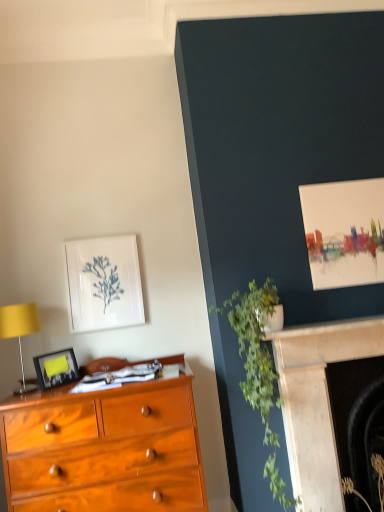
This screenshot has width=384, height=512. Describe the element at coordinates (259, 369) in the screenshot. I see `green leafy plant at upper right, which is counted as the 2th plant, starting from the right` at that location.

In order to face green leafy plant at lower right, which appears as the second plant when viewed from the left, should I rotate leftwards or rightwards?

Turn right approximately 23.437 degrees to face it.

This screenshot has height=512, width=384. I want to click on white matte picture frame at upper left, which is the 2th picture frame in bottom-to-top order, so click(103, 283).

Measure the distance between matte yellow lampshade at left and matte black picture frame at left, which is counted as the first picture frame, starting from the bottom.

They are 17.57 centimeters apart.

Is point (21, 386) positioned in front of point (56, 351)?

Yes.

Which of these two, matte yellow lampshade at left or matte black picture frame at left, the second picture frame viewed from the back, is wider?

Wider between the two is matte yellow lampshade at left.

From the image's perspective, is matte yellow lampshade at left positioned above or below matte black picture frame at left, which is counted as the first picture frame, starting from the bottom?

From the image's perspective, matte yellow lampshade at left appears above matte black picture frame at left, which is counted as the first picture frame, starting from the bottom.

The image size is (384, 512). What are the coordinates of `table lamp below the white matte picture frame at upper left, positioned as the first picture frame in top-to-bottom order (from the image's perspective)` in the screenshot? It's located at (19, 331).

In the image, is matte yellow lampshade at left on the left side or the right side of white matte picture frame at upper left, the first picture frame positioned from the back?

Clearly, matte yellow lampshade at left is on the left of white matte picture frame at upper left, the first picture frame positioned from the back, in the image.

Between matte yellow lampshade at left and white matte picture frame at upper left, positioned as the first picture frame in top-to-bottom order, which one is positioned in front?

matte yellow lampshade at left is more forward.

Can we say matte yellow lampshade at left lies outside white matte picture frame at upper left, positioned as the first picture frame in top-to-bottom order?

matte yellow lampshade at left lies outside white matte picture frame at upper left, positioned as the first picture frame in top-to-bottom order,'s area.

From the green leafy plant at upper right, which is counted as the 2th plant, starting from the right, count 2nd fireplaces backward and point to it. Please provide its 2D coordinates.

[(358, 420)]

Measure the distance between marble fireplace at lower right, the first fireplace in the back-to-front sequence, and green leafy plant at upper right, which is counted as the 2th plant, starting from the right.

marble fireplace at lower right, the first fireplace in the back-to-front sequence, is 43.13 centimeters away from green leafy plant at upper right, which is counted as the 2th plant, starting from the right.

From the image's perspective, between marble fireplace at lower right, which is the 2th fireplace from front to back, and green leafy plant at upper right, which is the 1th plant in left-to-right order, who is located below?

marble fireplace at lower right, which is the 2th fireplace from front to back, is shown below in the image.

Considering the positions of point (335, 386) and point (246, 352), is point (335, 386) closer or farther from the camera than point (246, 352)?

Point (335, 386) is farther from the camera than point (246, 352).

The image size is (384, 512). Identify the location of plant that is above the marble fireplace at lower right, placed as the 1th fireplace when sorted from front to back (from the image's perspective). (259, 369).

Based on the photo, from the image's perspective, between green leafy plant at upper right, which is counted as the 2th plant, starting from the right, and marble fireplace at lower right, placed as the 1th fireplace when sorted from front to back, which one is located above?

green leafy plant at upper right, which is counted as the 2th plant, starting from the right, appears higher in the image.

From a real-world perspective, is green leafy plant at upper right, which is counted as the 2th plant, starting from the right, physically located above or below marble fireplace at lower right, the 2th fireplace in the back-to-front sequence?

green leafy plant at upper right, which is counted as the 2th plant, starting from the right, is situated higher than marble fireplace at lower right, the 2th fireplace in the back-to-front sequence, in the real world.

Does green leafy plant at upper right, which is the 1th plant in left-to-right order, lie behind marble fireplace at lower right, placed as the 1th fireplace when sorted from front to back?

No, it is in front of marble fireplace at lower right, placed as the 1th fireplace when sorted from front to back.

Considering the relative sizes of green leafy plant at upper right, which is counted as the 2th plant, starting from the right, and green leafy plant at lower right, which appears as the second plant when viewed from the left, in the image provided, is green leafy plant at upper right, which is counted as the 2th plant, starting from the right, wider than green leafy plant at lower right, which appears as the second plant when viewed from the left,?

Yes, green leafy plant at upper right, which is counted as the 2th plant, starting from the right, is wider than green leafy plant at lower right, which appears as the second plant when viewed from the left.

Which of these two, green leafy plant at upper right, which is the 1th plant in left-to-right order, or green leafy plant at lower right, the first plant viewed from the right, is smaller?

green leafy plant at lower right, the first plant viewed from the right.

Is green leafy plant at upper right, which is the 1th plant in left-to-right order, looking in the opposite direction of green leafy plant at lower right, which appears as the second plant when viewed from the left?

No, green leafy plant at upper right, which is the 1th plant in left-to-right order, is not facing the opposite direction of green leafy plant at lower right, which appears as the second plant when viewed from the left.

Which is more to the right, green leafy plant at upper right, which is counted as the 2th plant, starting from the right, or green leafy plant at lower right, the first plant viewed from the right?

green leafy plant at lower right, the first plant viewed from the right.

The image size is (384, 512). In the image, there is a green leafy plant at lower right, which appears as the second plant when viewed from the left. Find the location of `plant above it (from the image's perspective)`. plant above it (from the image's perspective) is located at coordinates (259, 369).

What's the angular difference between green leafy plant at lower right, the first plant viewed from the right, and green leafy plant at upper right, which is the 1th plant in left-to-right order,'s facing directions?

The facing directions of green leafy plant at lower right, the first plant viewed from the right, and green leafy plant at upper right, which is the 1th plant in left-to-right order, are 21.6 degrees apart.

Looking at this image, could you measure the distance between green leafy plant at lower right, which appears as the second plant when viewed from the left, and green leafy plant at upper right, which is the 1th plant in left-to-right order?

27.04 inches.

Based on the photo, is green leafy plant at lower right, which appears as the second plant when viewed from the left, in contact with green leafy plant at upper right, which is the 1th plant in left-to-right order?

green leafy plant at lower right, which appears as the second plant when viewed from the left, and green leafy plant at upper right, which is the 1th plant in left-to-right order, are not in contact.

Is matte black picture frame at left, marked as the 2th picture frame in a top-to-bottom arrangement, positioned before matte yellow lampshade at left?

No, matte black picture frame at left, marked as the 2th picture frame in a top-to-bottom arrangement, is behind matte yellow lampshade at left.

Considering the sizes of matte black picture frame at left, marked as the 2th picture frame in a top-to-bottom arrangement, and matte yellow lampshade at left in the image, is matte black picture frame at left, marked as the 2th picture frame in a top-to-bottom arrangement, taller or shorter than matte yellow lampshade at left?

matte black picture frame at left, marked as the 2th picture frame in a top-to-bottom arrangement, is shorter than matte yellow lampshade at left.

You are a GUI agent. You are given a task and a screenshot of the screen. Output one action in this format:
    pyautogui.click(x=<x>, y=<y>)
    Task: Click on the picture frame below the matte yellow lampshade at left (from the image's perspective)
    This screenshot has width=384, height=512.
    Given the screenshot: What is the action you would take?
    pyautogui.click(x=56, y=368)

Is matte black picture frame at left, which is counted as the first picture frame, starting from the bottom, to the left of matte yellow lampshade at left from the viewer's perspective?

No.

Find the location of a particular element. table lamp that appears on the left of matte black picture frame at left, marked as the 2th picture frame in a top-to-bottom arrangement is located at coordinates (19, 331).

Where is `picture frame above the matte yellow lampshade at left (from the image's perspective)`? The image size is (384, 512). picture frame above the matte yellow lampshade at left (from the image's perspective) is located at coordinates (103, 283).

Considering their positions, is green leafy plant at upper right, which is counted as the 2th plant, starting from the right, positioned further to marble fireplace at lower right, placed as the 1th fireplace when sorted from front to back, than green leafy plant at lower right, the first plant viewed from the right?

Based on the image, green leafy plant at lower right, the first plant viewed from the right, appears to be further to marble fireplace at lower right, placed as the 1th fireplace when sorted from front to back.

Estimate the real-world distances between objects in this image. Which object is closer to matte black picture frame at left, the first picture frame positioned from the front, matte yellow lampshade at left or white matte picture frame at upper left, positioned as the first picture frame in top-to-bottom order?

Based on the image, matte yellow lampshade at left appears to be nearer to matte black picture frame at left, the first picture frame positioned from the front.

Based on their spatial positions, is green leafy plant at upper right, which is the 1th plant in left-to-right order, or matte black picture frame at left, which is counted as the first picture frame, starting from the bottom, further from marble fireplace at lower right, placed as the 1th fireplace when sorted from front to back?

matte black picture frame at left, which is counted as the first picture frame, starting from the bottom, lies further to marble fireplace at lower right, placed as the 1th fireplace when sorted from front to back, than the other object.

In the scene shown: Estimate the real-world distances between objects in this image. Which object is further from marble fireplace at lower right, which is the 2th fireplace from front to back, green leafy plant at lower right, which appears as the second plant when viewed from the left, or white matte picture frame at upper left, the first picture frame positioned from the back?

white matte picture frame at upper left, the first picture frame positioned from the back, is further to marble fireplace at lower right, which is the 2th fireplace from front to back.

Looking at the image, which one is located closer to matte yellow lampshade at left, marble fireplace at lower right, the 2th fireplace in the back-to-front sequence, or matte black picture frame at left, which is counted as the first picture frame, starting from the bottom?

The object closer to matte yellow lampshade at left is matte black picture frame at left, which is counted as the first picture frame, starting from the bottom.

Which object lies nearer to the anchor point matte yellow lampshade at left, green leafy plant at upper right, which is counted as the 2th plant, starting from the right, or marble fireplace at lower right, the 2th fireplace in the back-to-front sequence?

Based on the image, green leafy plant at upper right, which is counted as the 2th plant, starting from the right, appears to be nearer to matte yellow lampshade at left.

When comparing their distances from green leafy plant at upper right, which is the 1th plant in left-to-right order, does matte yellow lampshade at left or marble fireplace at lower right, which is the 2th fireplace from front to back, seem further?

Based on the image, matte yellow lampshade at left appears to be further to green leafy plant at upper right, which is the 1th plant in left-to-right order.

Based on their spatial positions, is white matte picture frame at upper left, which is the 2th picture frame in bottom-to-top order, or matte yellow lampshade at left closer to marble fireplace at lower right, which is the 2th fireplace from front to back?

white matte picture frame at upper left, which is the 2th picture frame in bottom-to-top order, lies closer to marble fireplace at lower right, which is the 2th fireplace from front to back, than the other object.

Where is `plant situated between green leafy plant at upper right, which is counted as the 2th plant, starting from the right, and marble fireplace at lower right, which is the 2th fireplace from front to back, from left to right`? Image resolution: width=384 pixels, height=512 pixels. plant situated between green leafy plant at upper right, which is counted as the 2th plant, starting from the right, and marble fireplace at lower right, which is the 2th fireplace from front to back, from left to right is located at coordinates (379, 476).

Where is `fireplace between white matte picture frame at upper left, positioned as the first picture frame in top-to-bottom order, and green leafy plant at lower right, which appears as the second plant when viewed from the left, from left to right`? Image resolution: width=384 pixels, height=512 pixels. fireplace between white matte picture frame at upper left, positioned as the first picture frame in top-to-bottom order, and green leafy plant at lower right, which appears as the second plant when viewed from the left, from left to right is located at coordinates (317, 401).

The height and width of the screenshot is (512, 384). Find the location of `fireplace between marble fireplace at lower right, the 2th fireplace in the back-to-front sequence, and green leafy plant at lower right, which appears as the second plant when viewed from the left, from top to bottom`. fireplace between marble fireplace at lower right, the 2th fireplace in the back-to-front sequence, and green leafy plant at lower right, which appears as the second plant when viewed from the left, from top to bottom is located at coordinates (358, 420).

Locate an element on the screen. The width and height of the screenshot is (384, 512). fireplace situated between green leafy plant at upper right, which is counted as the 2th plant, starting from the right, and marble fireplace at lower right, the first fireplace in the back-to-front sequence, from left to right is located at coordinates 317,401.